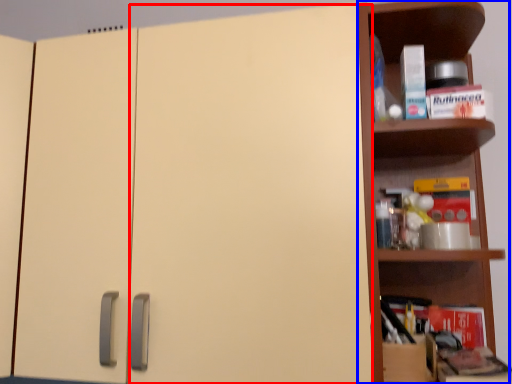
Question: Among these objects, which one is nearest to the camera, door (highlighted by a red box) or shelf (highlighted by a blue box)?

Choices:
 (A) door
 (B) shelf

Answer: (A)